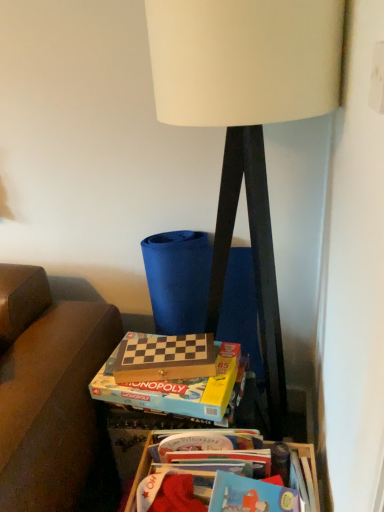
Question: From a real-world perspective, is wooden chess set at center, which ranks as the 2th paperback book in back-to-front order, physically located above or below wooden chess set at lower center, which is the 2th paperback book from front to back?

Choices:
 (A) below
 (B) above

Answer: (A)

Question: Is wooden chess set at center, the 1th paperback book in the front-to-back sequence, taller or shorter than wooden chess set at lower center, which appears as the first paperback book when viewed from the back?

Choices:
 (A) short
 (B) tall

Answer: (B)

Question: Which object is the closest to the wooden chess set at center, which ranks as the 2th paperback book in back-to-front order?

Choices:
 (A) wooden chess set at lower center, which appears as the first paperback book when viewed from the back
 (B) white matte lamp at center
 (C) wooden at lower right

Answer: (A)

Question: Which of these objects is positioned farthest from the wooden chess set at lower center, which appears as the first paperback book when viewed from the back?

Choices:
 (A) white matte lamp at center
 (B) wooden chess set at center, which ranks as the 2th paperback book in back-to-front order
 (C) wooden at lower right

Answer: (A)